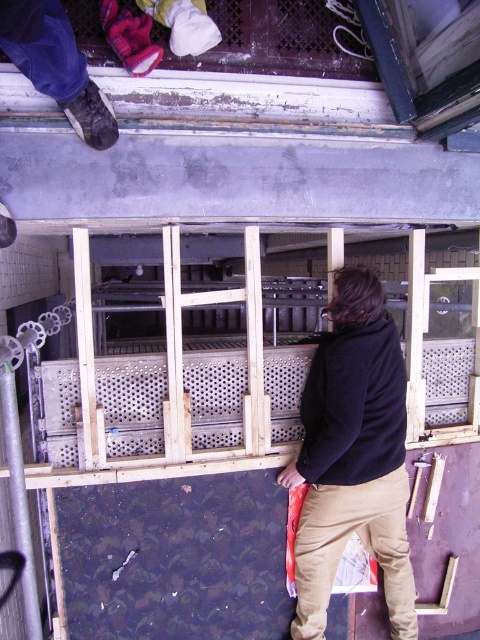
You are a safety inspector assessing the construction site depicted in the image. You notice the black fleece jacket at center and the wooden frame at upper center. Based on their heights, which object would you need to adjust to ensure proper safety clearance for workers moving between them?

The black fleece jacket at center is much taller than the wooden frame at upper center. To ensure proper safety clearance, the black fleece jacket at center would need to be adjusted or removed since it is the taller object and could pose a hazard if workers are moving between them.

You are a construction worker who needs to place a 2.0 meter long safety barrier between the wooden frame at upper center and the camera. Can you fit the safety barrier between them?

The distance between the wooden frame at upper center and the camera is 1.90 meters. Since the safety barrier is 2.0 meters long, it cannot be placed between them as the space is shorter than the barrier.